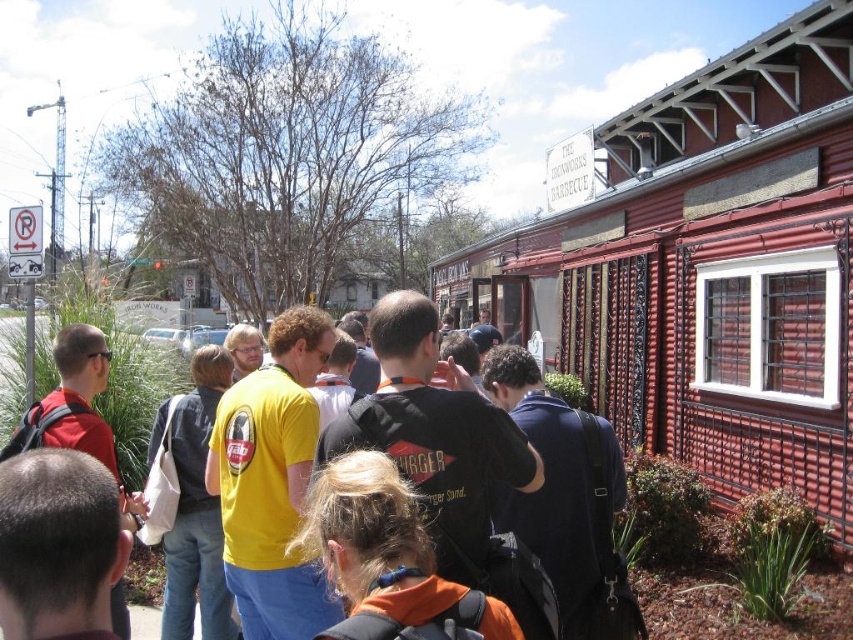
From the picture: You are a photographer standing in front of the red corrugated metal building. You notice two backpacks at the center of the scene. Which backpack is taller, the black backpack at center or the orange fabric backpack at center?

The black backpack at center is much taller than the orange fabric backpack at center.